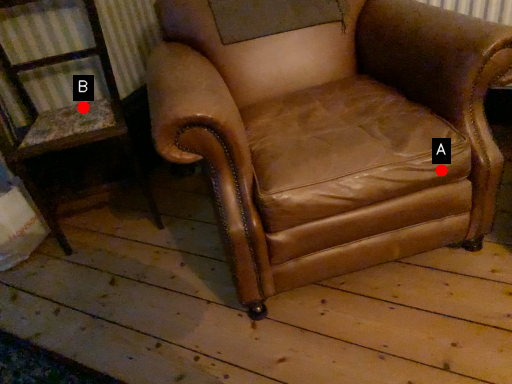
Question: Two points are circled on the image, labeled by A and B beside each circle. Which of the following is the closest to the observer?

Choices:
 (A) A is closer
 (B) B is closer

Answer: (A)